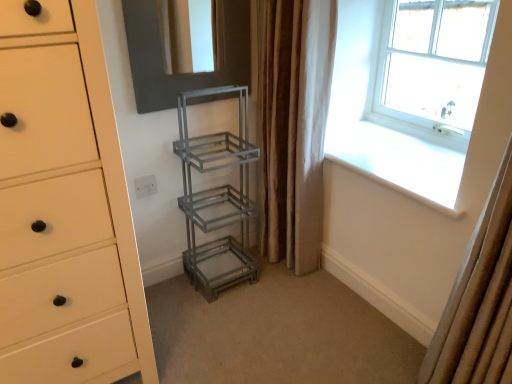
The height and width of the screenshot is (384, 512). I want to click on vacant region below metallic gray shelf at center (from a real-world perspective), so click(x=230, y=266).